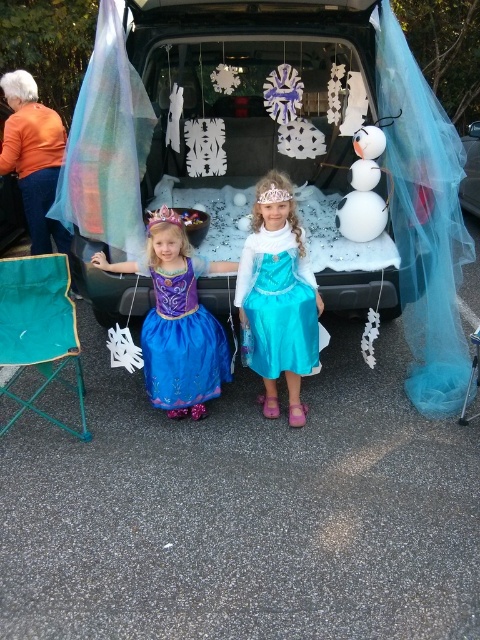
You are a photographer at a winter festival. You need to capture a photo of the white fluffy snowman at center and the turquoise satin dress at center. According to the scene description, which object is located to the left of the other?

The turquoise satin dress at center is located to the left of the white fluffy snowman at center because the white fluffy snowman at center is positioned on the right side of the turquoise satin dress at center.

You are organizing a winter festival and need to arrange two snowmen in front of a decorated car trunk. The scene has a white fluffy snowman at center and a white matte snowman at right. Which snowman should you place closer to the entrance to make it more noticeable?

The white fluffy snowman at center is larger in size than the white matte snowman at right, so placing it closer to the entrance would make it more noticeable due to its size.

You are a photographer taking pictures of the festive event. You need to position a decorative snowflake so that it is exactly at the point marked by the coordinate point (226, 138). What object is located at that coordinate?

The point (226, 138) marks the location of the white fluffy snowman at center.